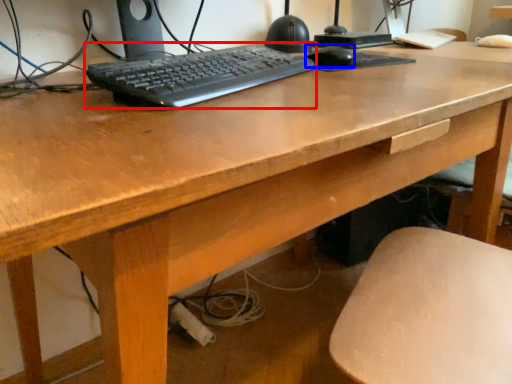
Question: Which of the following is the farthest to the observer, computer keyboard (highlighted by a red box) or mouse (highlighted by a blue box)?

Choices:
 (A) computer keyboard
 (B) mouse

Answer: (B)